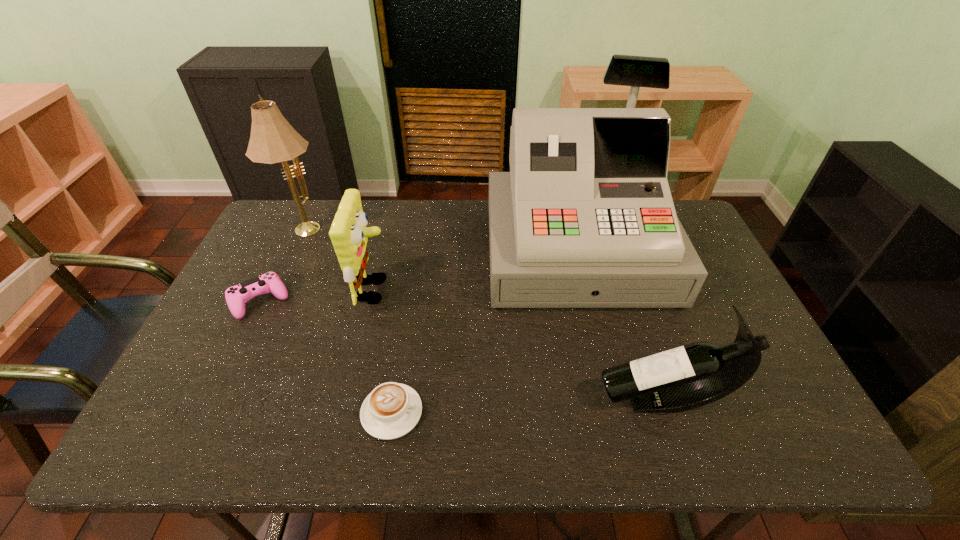
Find the location of `cash register`. cash register is located at coordinates (585, 218).

This screenshot has height=540, width=960. I want to click on lampshade, so click(x=273, y=140).

The width and height of the screenshot is (960, 540). What are the coordinates of `sponge` in the screenshot? It's located at (348, 233).

Locate an element on the screen. This screenshot has height=540, width=960. wine bottle is located at coordinates (690, 376).

Image resolution: width=960 pixels, height=540 pixels. I want to click on control, so click(x=236, y=296).

Find the location of a particular element. cappuccino is located at coordinates (391, 410).

At what (x,y) coordinates should I click in order to perform the action: click on vacant position located 0.390m on the keypad side of the cash register. Please return your answer as a coordinate pair (x, y). This screenshot has height=540, width=960. Looking at the image, I should click on (x=624, y=450).

Image resolution: width=960 pixels, height=540 pixels. Identify the location of vacant area situated 0.080m on the front of the lampshade. coord(289,260).

This screenshot has width=960, height=540. I want to click on free spot located on the face of the sponge, so click(530, 291).

You are a GUI agent. You are given a task and a screenshot of the screen. Output one action in this format:
    pyautogui.click(x=<x>, y=<y>)
    Task: Click on the blank space located 0.310m on the stand of the wine bottle
    This screenshot has height=540, width=960.
    Given the screenshot: What is the action you would take?
    pyautogui.click(x=463, y=399)